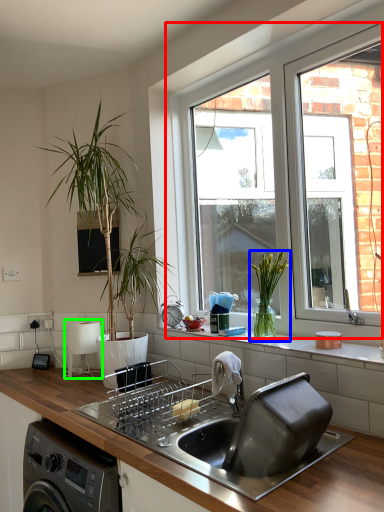
Question: Which object is positioned closest to window (highlighted by a red box)? Select from houseplant (highlighted by a blue box) and appliance (highlighted by a green box).

Choices:
 (A) houseplant
 (B) appliance

Answer: (A)